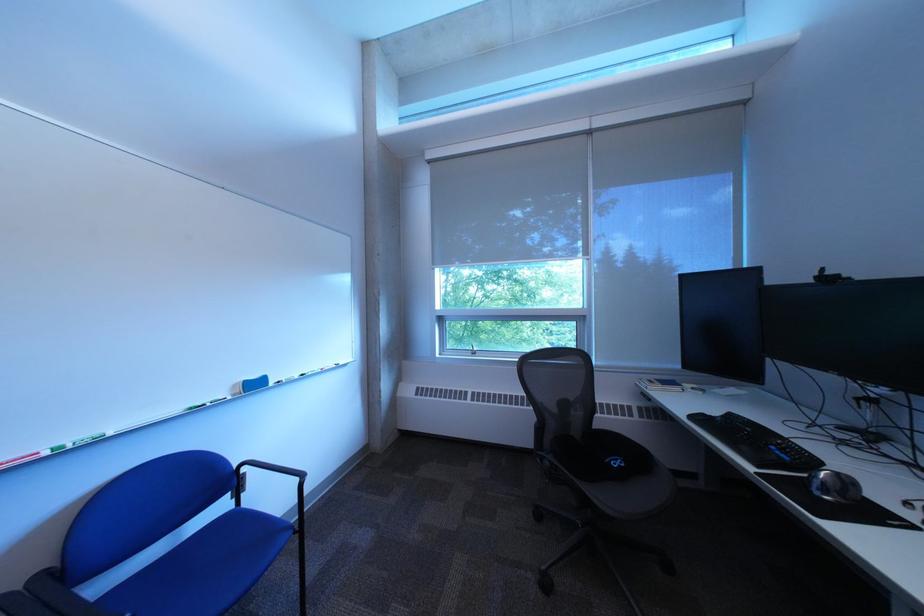
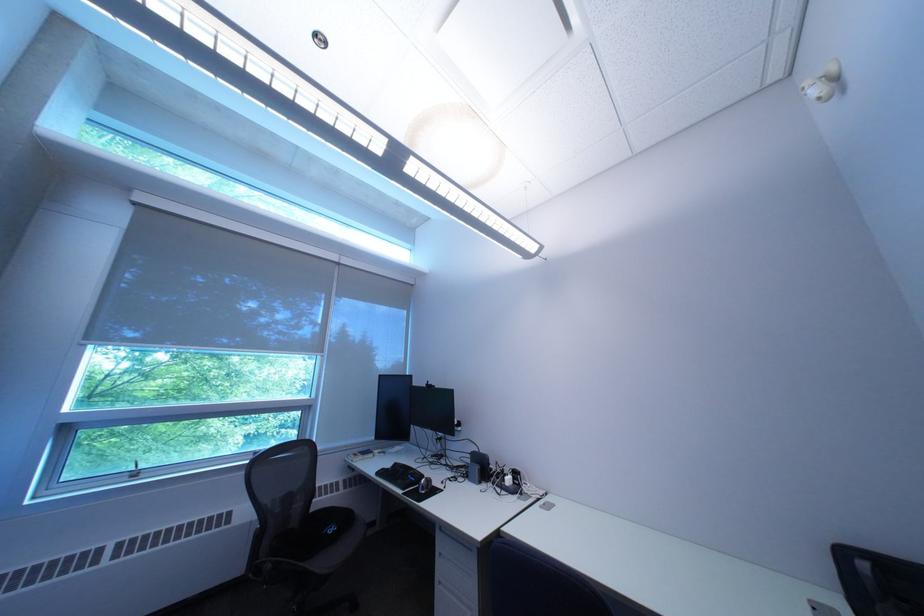
Locate, in the second image, the point that corresponds to pixel 772 475 in the first image.

(418, 495)